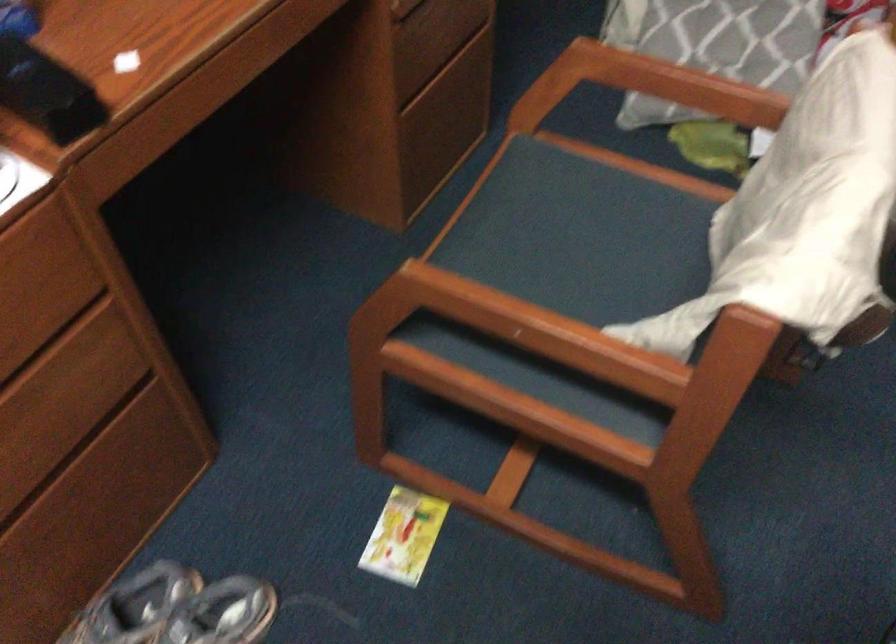
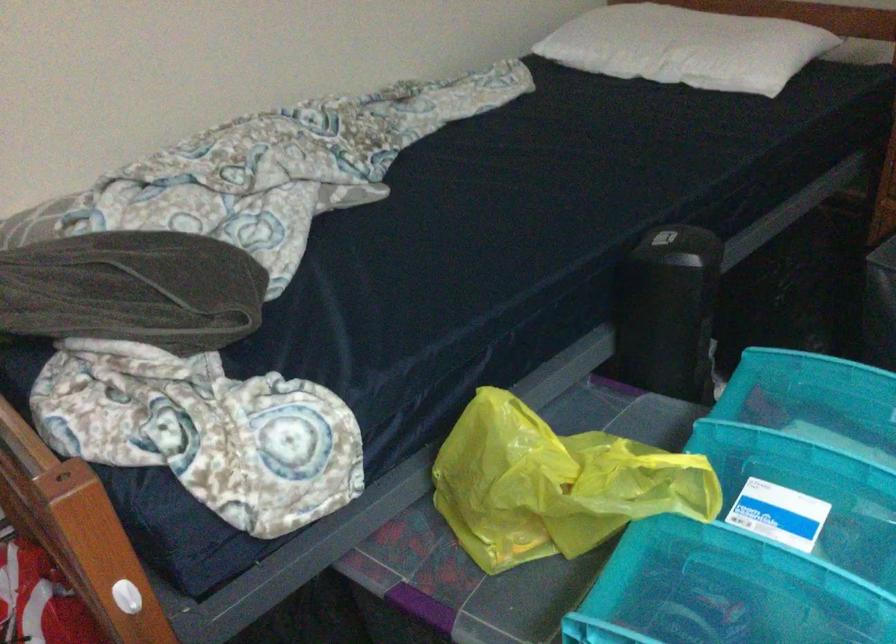
Question: How did the camera likely rotate?

Choices:
 (A) Left
 (B) Right
 (C) Up
 (D) Down

Answer: (B)